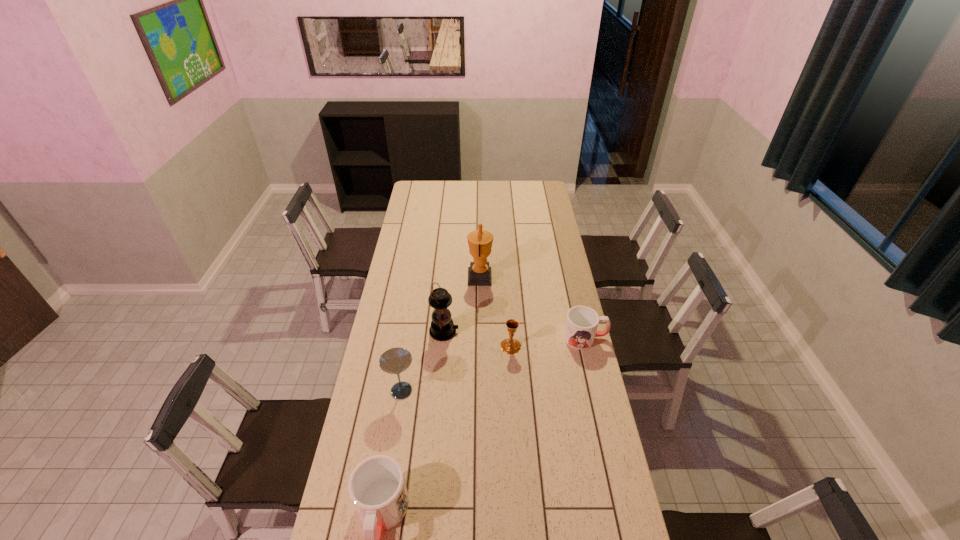
Please point a space for a new mug to maintain equal intervals. Please provide its 2D coordinates. Your answer should be formatted as a tuple, i.e. [(x, y)], where the tuple contains the x and y coordinates of a point satisfying the conditions above.

[(500, 412)]